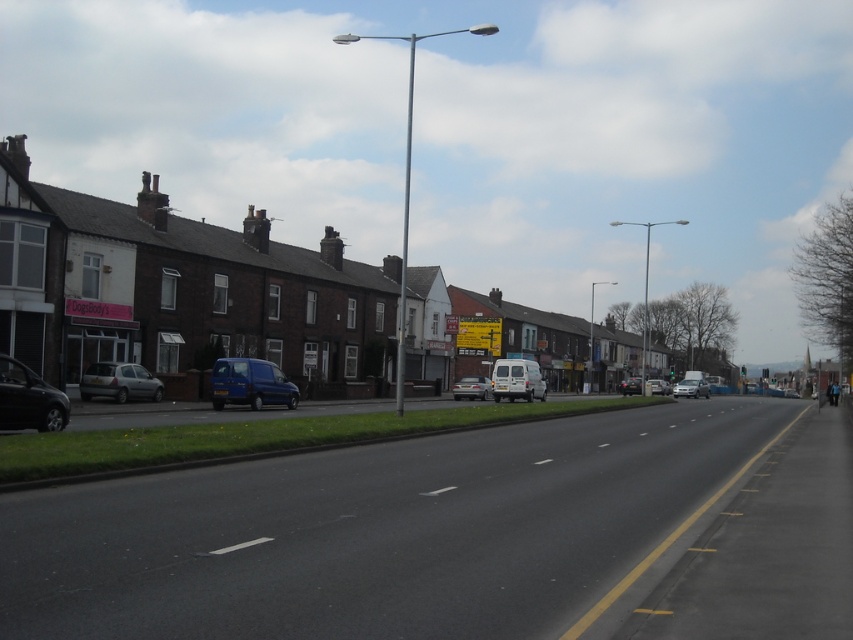
Which is below, shiny black car at left or silver metallic van at center?

silver metallic van at center is below.

Does point (38, 387) lie behind point (657, 378)?

That is False.

Which is behind, point (54, 408) or point (654, 380)?

The point (654, 380) is more distant.

Find the location of a particular element. shiny black car at left is located at coordinates (28, 400).

Does point (128, 374) lie behind point (660, 380)?

No, it is not.

Between silver metallic hatchback at left and silver metallic van at center, which one is positioned lower?

silver metallic van at center

This screenshot has height=640, width=853. Find the location of `silver metallic hatchback at left`. silver metallic hatchback at left is located at coordinates pyautogui.click(x=119, y=381).

Between metallic silver sedan at center and silver metallic van at center, which one has less height?

metallic silver sedan at center

This screenshot has width=853, height=640. What are the coordinates of `metallic silver sedan at center` in the screenshot? It's located at (473, 387).